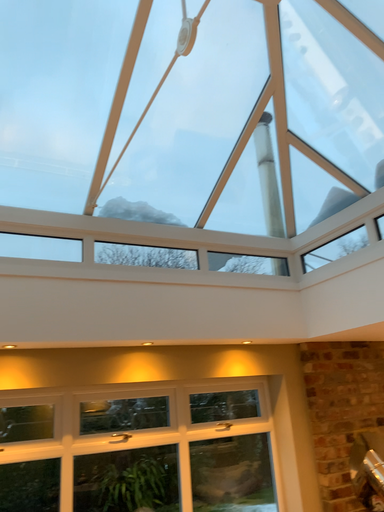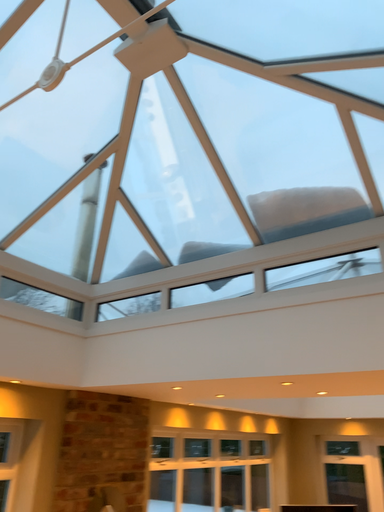
Question: How did the camera likely rotate when shooting the video?

Choices:
 (A) rotated right
 (B) rotated left

Answer: (A)